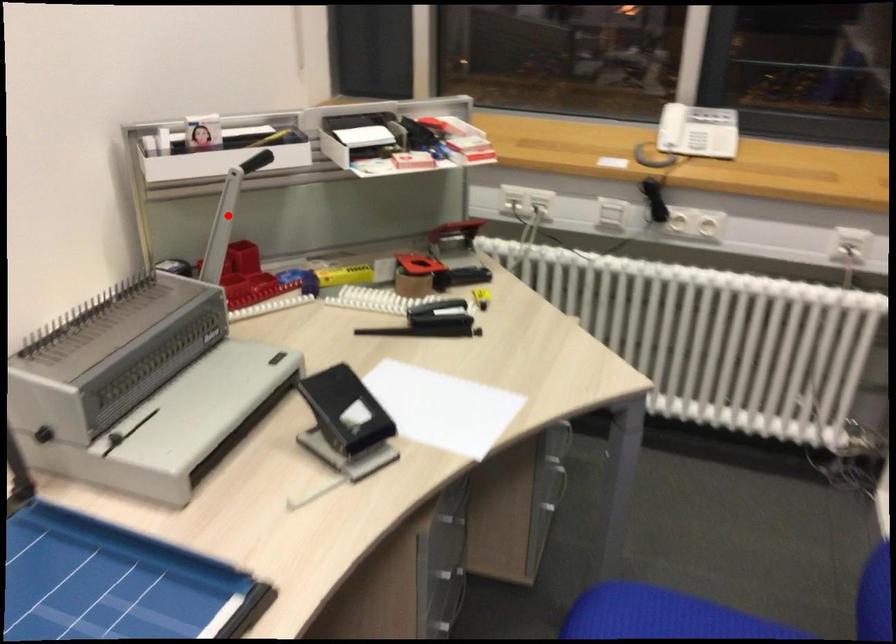
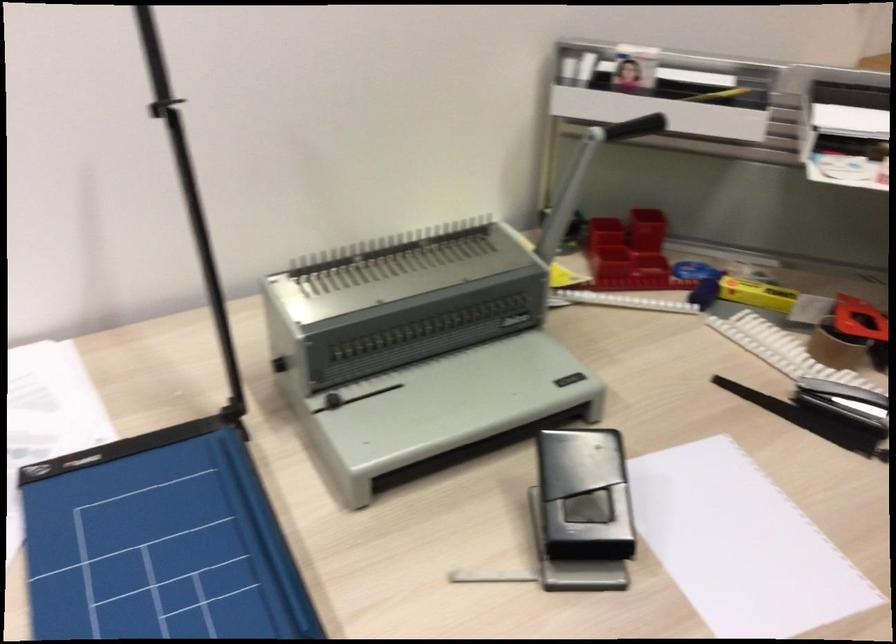
Question: I am providing you with two images of the same scene from different viewpoints. A red point is marked on the first image. At the location where the point appears in image 1, is it still visible in image 2?

Choices:
 (A) Yes
 (B) No

Answer: (B)